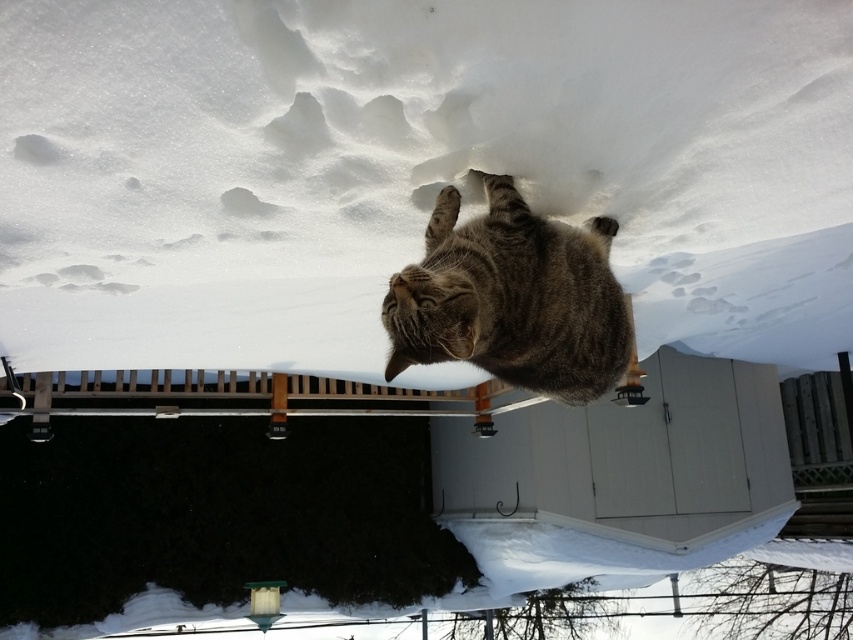
You are a photographer trying to capture the tabby fur cat at center. You notice the white fluffy snow at upper center might reflect light into the camera lens. To avoid glare, should you position yourself to the left or right of the cat?

You should position yourself to the right of the tabby fur cat at center because the white fluffy snow at upper center is located to the left of the cat, and moving to the right would place the snow behind or beside you, reducing glare.

You are a photographer trying to capture the tabby fur cat at center in your shot. However, you notice the white fluffy snow at upper center is blocking your view. Can you adjust your camera angle to see the cat without moving the snow?

The white fluffy snow at upper center is in front of the tabby fur cat at center, so adjusting the camera angle downward might allow you to see the cat by moving the camera lower to avoid the obstruction from the snow.